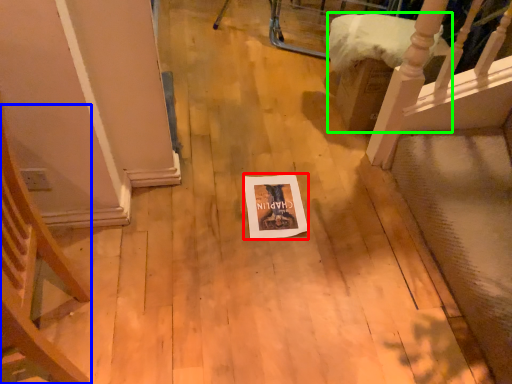
Question: Estimate the real-world distances between objects in this image. Which object is farther from postcard (highlighted by a red box), armchair (highlighted by a blue box) or furniture (highlighted by a green box)?

Choices:
 (A) armchair
 (B) furniture

Answer: (A)